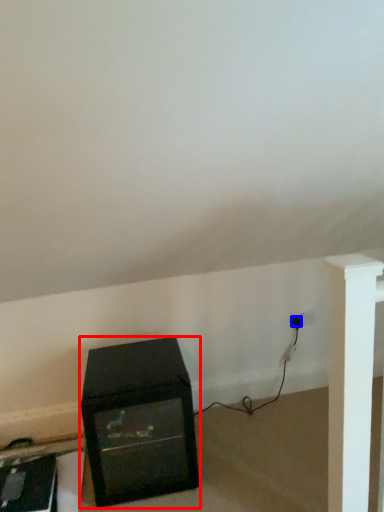
Question: Which object appears closest to the camera in this image, furniture (highlighted by a red box) or plug (highlighted by a blue box)?

Choices:
 (A) furniture
 (B) plug

Answer: (A)